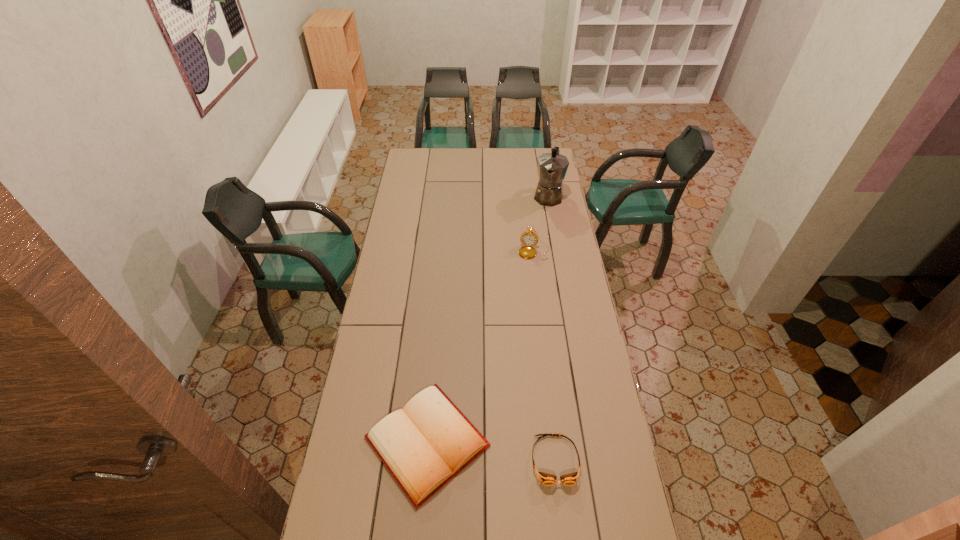
This screenshot has width=960, height=540. Find the location of `empty space that is in between the coffeepot and the goggles`. empty space that is in between the coffeepot and the goggles is located at coordinates (551, 328).

Image resolution: width=960 pixels, height=540 pixels. In order to click on free space between the Bible and the goggles in this screenshot , I will do `click(492, 451)`.

At what (x,y) coordinates should I click in order to perform the action: click on free point between the leftmost object and the goggles. Please return your answer as a coordinate pair (x, y). Looking at the image, I should click on (492, 451).

Locate an element on the screen. The width and height of the screenshot is (960, 540). vacant point located between the coffeepot and the goggles is located at coordinates (551, 328).

Locate which object ranks third in proximity to the goggles. Please provide its 2D coordinates. Your answer should be formatted as a tuple, i.e. [(x, y)], where the tuple contains the x and y coordinates of a point satisfying the conditions above.

[(552, 167)]

Locate which object is the closest to the leftmost object. Please provide its 2D coordinates. Your answer should be formatted as a tuple, i.e. [(x, y)], where the tuple contains the x and y coordinates of a point satisfying the conditions above.

[(546, 479)]

This screenshot has height=540, width=960. I want to click on free spot that satisfies the following two spatial constraints: 1. on the back side of the leftmost object; 2. on the left side of the third nearest object, so click(444, 252).